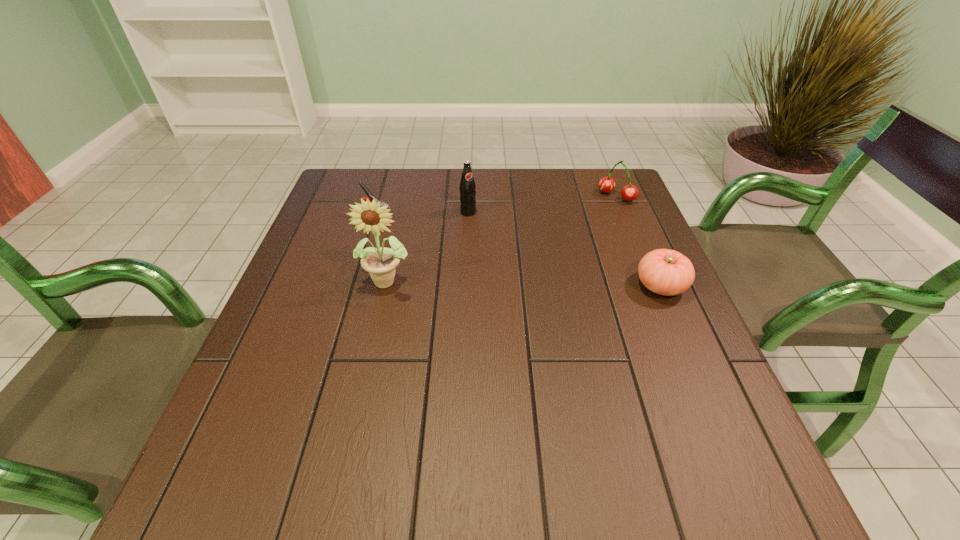
The image size is (960, 540). Identify the location of free region located 0.400m on the front label of the fourth shortest object. (567, 304).

In order to click on vacant space located 0.110m with stems pointing upwards on the farthest object in this screenshot , I will do `click(588, 220)`.

The width and height of the screenshot is (960, 540). Identify the location of vacant position located with stems pointing upwards on the farthest object. (579, 228).

The height and width of the screenshot is (540, 960). Find the location of `free location located 0.280m with stems pointing upwards on the farthest object`. free location located 0.280m with stems pointing upwards on the farthest object is located at coordinates (555, 251).

Find the location of `vacant space located 0.280m on the handle side of the stapler`. vacant space located 0.280m on the handle side of the stapler is located at coordinates (469, 264).

Where is `blank space located on the handle side of the stapler`? blank space located on the handle side of the stapler is located at coordinates (483, 270).

You are a GUI agent. You are given a task and a screenshot of the screen. Output one action in this format:
    pyautogui.click(x=<x>, y=<y>)
    Task: Click on the vacant space located on the handle side of the stapler
    This screenshot has height=540, width=960.
    Given the screenshot: What is the action you would take?
    pyautogui.click(x=410, y=233)

I want to click on pop that is positioned at the far edge, so click(x=467, y=188).

Image resolution: width=960 pixels, height=540 pixels. Identify the location of cherry situated at the far edge. (630, 192).

This screenshot has width=960, height=540. What are the coordinates of `stapler at the far edge` in the screenshot? It's located at (370, 197).